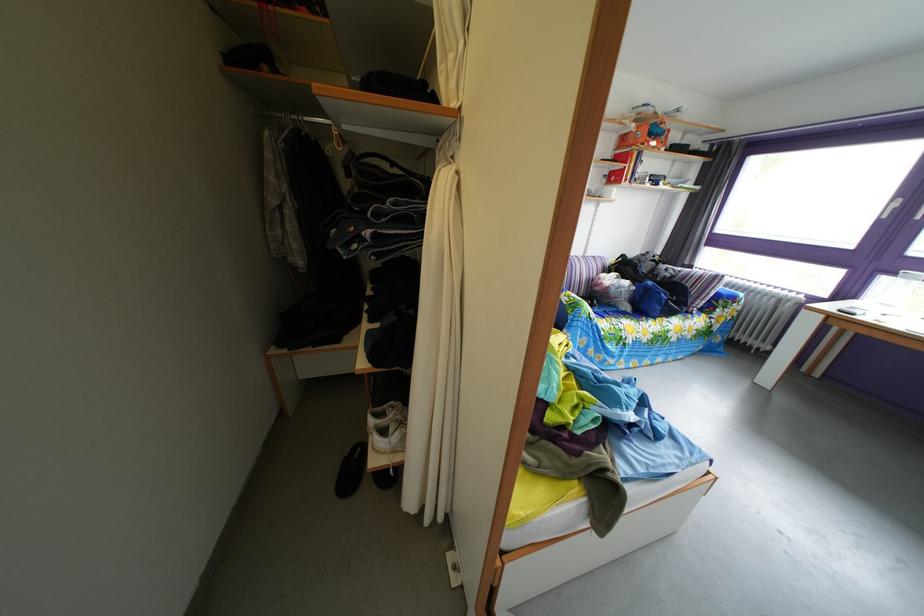
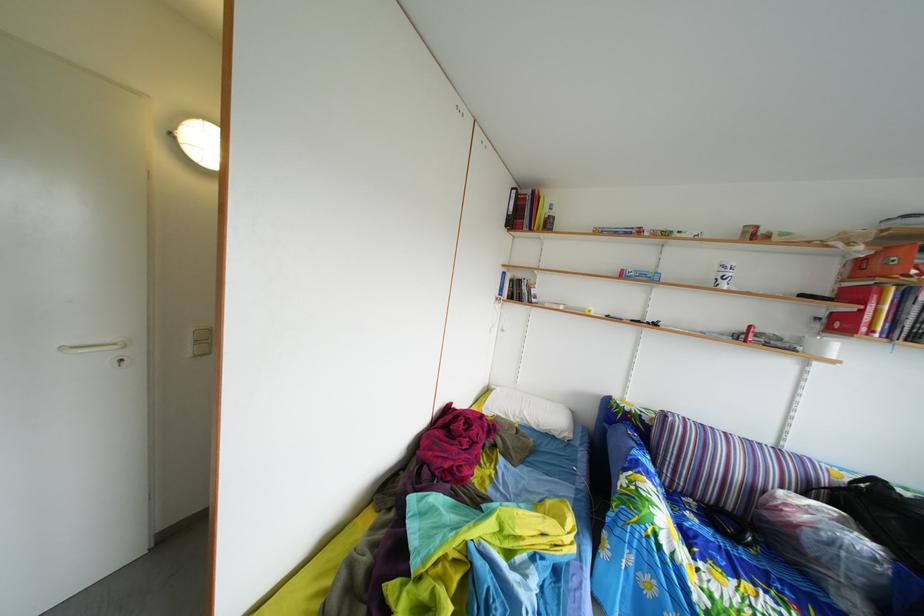
Where in the second image is the point corresponding to point (634, 275) from the first image?

(886, 515)